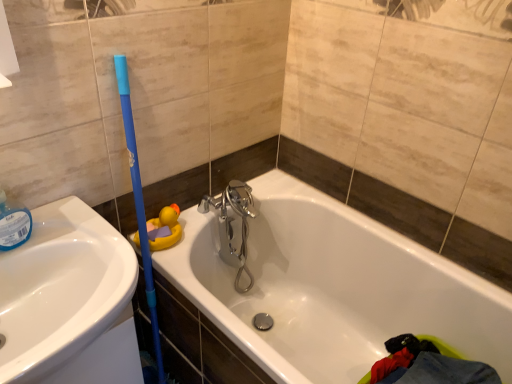
What do you see at coordinates (69, 301) in the screenshot? I see `white glossy sink at left` at bounding box center [69, 301].

In order to click on yellow rubber duck at upper left in this screenshot , I will do `click(164, 228)`.

Which is nearer, (68, 334) or (322, 335)?

Point (68, 334) appears to be closer to the viewer than point (322, 335).

Based on the photo, between white glossy sink at left and white glossy bathtub at center, which one is positioned behind?

white glossy sink at left is further away from the camera.

Is white glossy sink at left oriented towards white glossy bathtub at center?

No, white glossy sink at left does not turn towards white glossy bathtub at center.

Is yellow rubber duck at upper left thinner than white glossy bathtub at center?

Yes, yellow rubber duck at upper left is thinner than white glossy bathtub at center.

How many degrees apart are the facing directions of yellow rubber duck at upper left and white glossy bathtub at center?

They differ by 90 degrees in their facing directions.

How distant is yellow rubber duck at upper left from white glossy bathtub at center?

yellow rubber duck at upper left is 19.78 inches away from white glossy bathtub at center.

Considering the relative positions of yellow rubber duck at upper left and white glossy bathtub at center in the image provided, is yellow rubber duck at upper left to the left or to the right of white glossy bathtub at center?

yellow rubber duck at upper left is positioned on white glossy bathtub at center's left side.

From a real-world perspective, is white glossy bathtub at center above or below yellow rubber duck at upper left?

From a real-world perspective, white glossy bathtub at center is physically below yellow rubber duck at upper left.

Who is bigger, white glossy bathtub at center or yellow rubber duck at upper left?

white glossy bathtub at center.

Considering the positions of objects white glossy bathtub at center and yellow rubber duck at upper left in the image provided, who is behind, white glossy bathtub at center or yellow rubber duck at upper left?

yellow rubber duck at upper left.

From their relative heights in the image, would you say white glossy bathtub at center is taller or shorter than yellow rubber duck at upper left?

Clearly, white glossy bathtub at center is taller compared to yellow rubber duck at upper left.

Is white glossy sink at left completely or partially outside of yellow rubber duck at upper left?

white glossy sink at left lies outside yellow rubber duck at upper left's area.

Is white glossy sink at left beside yellow rubber duck at upper left?

white glossy sink at left is not next to yellow rubber duck at upper left, and they're not touching.

From the image's perspective, which object appears higher, white glossy sink at left or yellow rubber duck at upper left?

yellow rubber duck at upper left.

Considering the relative sizes of white glossy sink at left and yellow rubber duck at upper left in the image provided, is white glossy sink at left smaller than yellow rubber duck at upper left?

Actually, white glossy sink at left might be larger than yellow rubber duck at upper left.

Which is farther from the camera, (x=150, y=230) or (x=87, y=319)?

Point (x=150, y=230)

Which of these two, yellow rubber duck at upper left or white glossy sink at left, stands taller?

Standing taller between the two is white glossy sink at left.

Considering their positions, is yellow rubber duck at upper left located in front of or behind white glossy sink at left?

yellow rubber duck at upper left is positioned farther from the viewer than white glossy sink at left.

Is white glossy bathtub at center not within white glossy sink at left?

Indeed, white glossy bathtub at center is completely outside white glossy sink at left.

Locate an element on the screen. This screenshot has height=384, width=512. bathtub on the right of white glossy sink at left is located at coordinates (342, 279).

Between white glossy bathtub at center and white glossy sink at left, which one has smaller size?

Smaller between the two is white glossy sink at left.

Is white glossy bathtub at center oriented towards white glossy sink at left?

Yes, white glossy bathtub at center is oriented towards white glossy sink at left.

Locate an element on the screen. The height and width of the screenshot is (384, 512). sink behind the white glossy bathtub at center is located at coordinates (69, 301).

This screenshot has height=384, width=512. Identify the location of bathtub to the right of yellow rubber duck at upper left. (x=342, y=279).

Based on their spatial positions, is white glossy sink at left or white glossy bathtub at center further from yellow rubber duck at upper left?

The object further to yellow rubber duck at upper left is white glossy bathtub at center.

Which object lies further to the anchor point white glossy sink at left, yellow rubber duck at upper left or white glossy bathtub at center?

white glossy bathtub at center.

Which object lies further to the anchor point white glossy bathtub at center, white glossy sink at left or yellow rubber duck at upper left?

Among the two, white glossy sink at left is located further to white glossy bathtub at center.

When comparing their distances from white glossy bathtub at center, does yellow rubber duck at upper left or white glossy sink at left seem further?

white glossy sink at left.

Based on their spatial positions, is white glossy bathtub at center or white glossy sink at left closer to yellow rubber duck at upper left?

Based on the image, white glossy sink at left appears to be nearer to yellow rubber duck at upper left.

Considering their positions, is white glossy bathtub at center positioned further to white glossy sink at left than yellow rubber duck at upper left?

Based on the image, white glossy bathtub at center appears to be further to white glossy sink at left.

You are a GUI agent. You are given a task and a screenshot of the screen. Output one action in this format:
    pyautogui.click(x=<x>, y=<y>)
    Task: Click on the toy between white glossy sink at left and white glossy bathtub at center in the horizontal direction
    This screenshot has width=512, height=384.
    Given the screenshot: What is the action you would take?
    pyautogui.click(x=164, y=228)